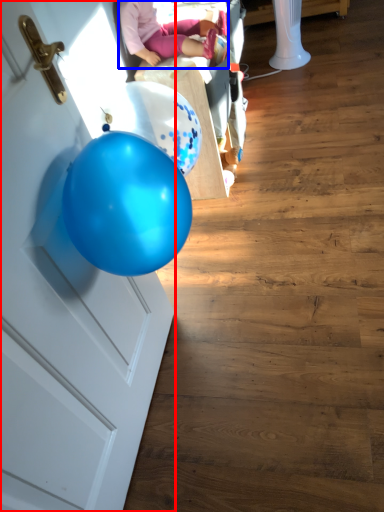
Question: Which object appears closest to the camera in this image, door (highlighted by a red box) or person (highlighted by a blue box)?

Choices:
 (A) door
 (B) person

Answer: (A)